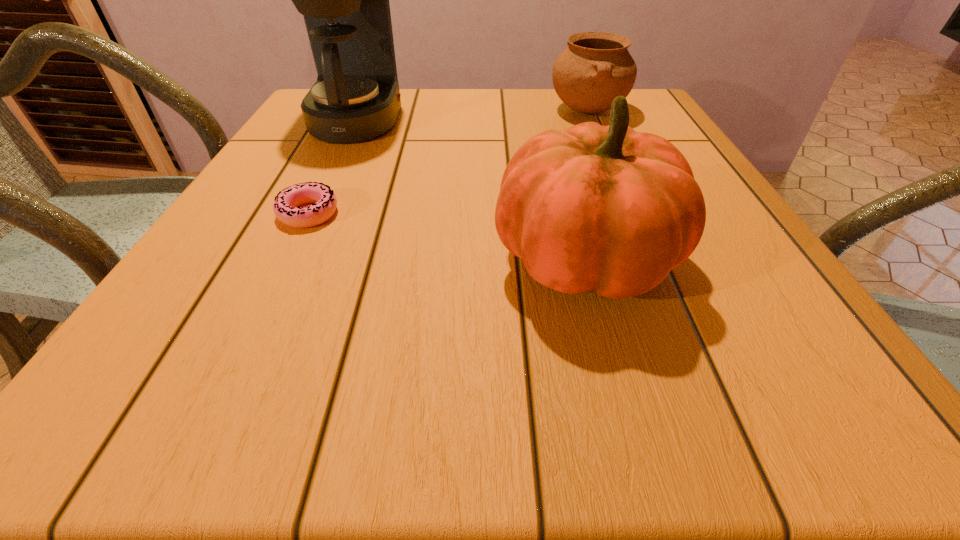
Where is `free space at the far right corner of the desktop`? free space at the far right corner of the desktop is located at coordinates (657, 122).

Identify the location of vacant area between the tallest object and the second tallest object. Image resolution: width=960 pixels, height=540 pixels. (470, 191).

At what (x,y) coordinates should I click in order to perform the action: click on unoccupied position between the doughnut and the third shortest object. Please return your answer as a coordinate pair (x, y). Looking at the image, I should click on 446,237.

Find the location of a particular element. This screenshot has height=540, width=960. free space between the pumpkin and the doughnut is located at coordinates (446, 237).

The height and width of the screenshot is (540, 960). Identify the location of free area in between the shortest object and the third tallest object. (448, 163).

Locate an element on the screen. The width and height of the screenshot is (960, 540). vacant point located between the pottery and the coffee maker is located at coordinates (472, 116).

Where is `free space between the shortest object and the pottery`? free space between the shortest object and the pottery is located at coordinates (448, 163).

This screenshot has width=960, height=540. I want to click on free spot between the doughnut and the coffee maker, so click(x=332, y=166).

Where is `free spot between the second shortest object and the shortest object`? free spot between the second shortest object and the shortest object is located at coordinates (448, 163).

Select which object appears as the third closest to the pumpkin. Please provide its 2D coordinates. Your answer should be formatted as a tuple, i.e. [(x, y)], where the tuple contains the x and y coordinates of a point satisfying the conditions above.

[(354, 97)]